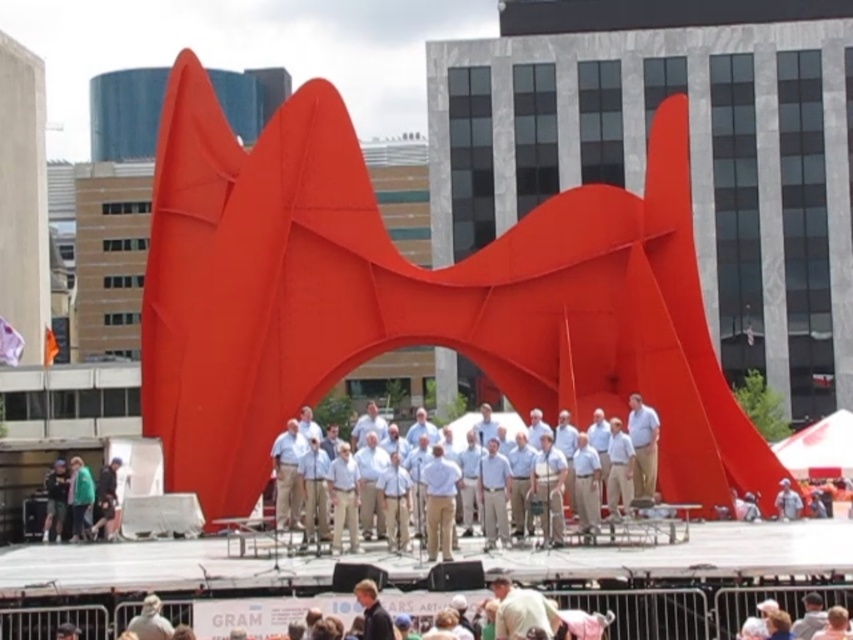
Question: Which object appears farthest from the camera in this image?

Choices:
 (A) light brown leather jacket at lower center
 (B) tan fabric shirt at center

Answer: (B)

Question: Does matte red sculpture at center have a larger size compared to tan fabric shirt at center?

Choices:
 (A) no
 (B) yes

Answer: (B)

Question: Does matte red sculpture at center appear on the left side of light blue shirt at center?

Choices:
 (A) yes
 (B) no

Answer: (A)

Question: Which point is farther to the camera?

Choices:
 (A) (637, 488)
 (B) (512, 294)
 (C) (494, 620)

Answer: (B)

Question: Which point is closer to the camera?

Choices:
 (A) (465, 448)
 (B) (184, 317)
 (C) (637, 422)

Answer: (A)

Question: Is matte red sculpture at center wider than light brown leather jacket at lower center?

Choices:
 (A) yes
 (B) no

Answer: (A)